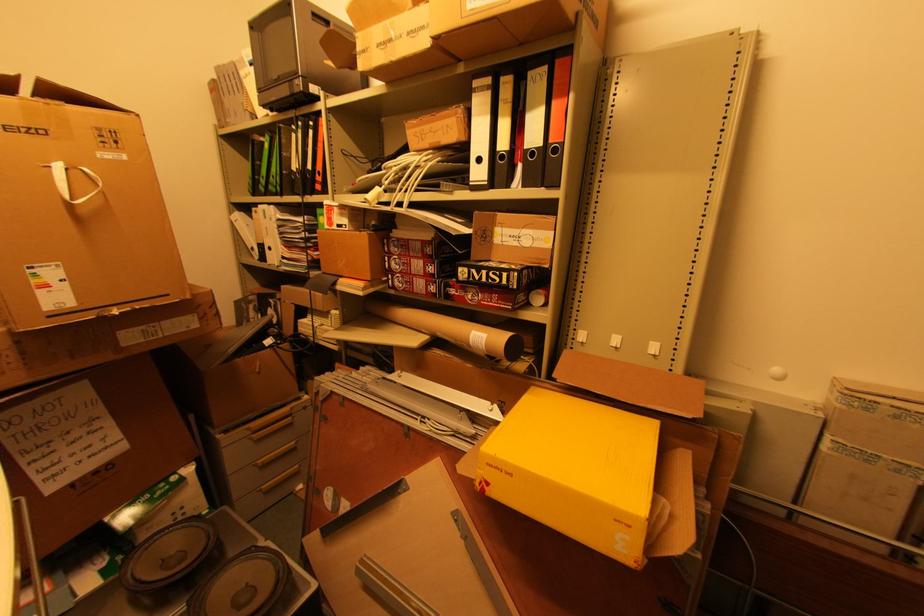
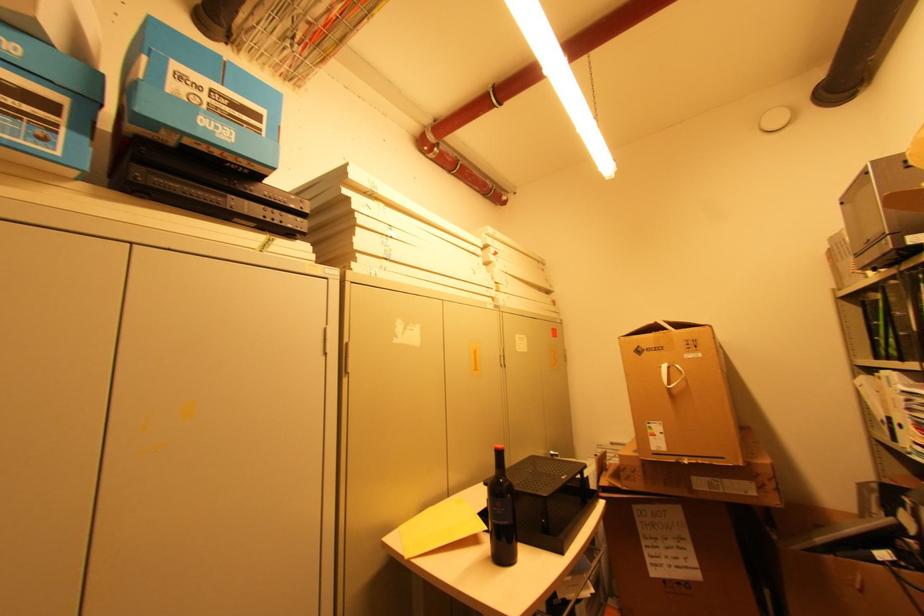
Locate, in the second image, the point that corresponds to the point at 286,150 in the first image.

(896, 310)